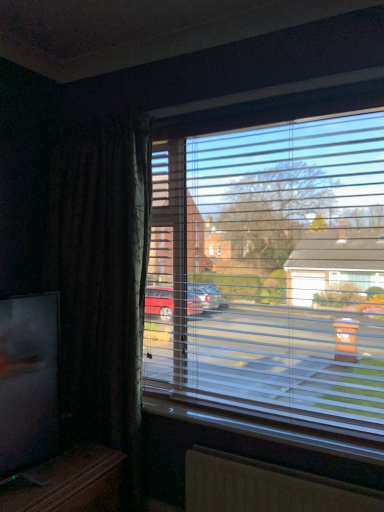
Find the location of a particular element. Image resolution: width=384 pixels, height=512 pixels. transparent plastic blinds at center is located at coordinates (282, 283).

Measure the distance between point (98, 469) and camera.

The distance of point (98, 469) from camera is 1.89 meters.

What is the approximate width of white plastic window sill at lower center?

The width of white plastic window sill at lower center is 6.18 inches.

Measure the distance between point (x=214, y=462) and camera.

Point (x=214, y=462) and camera are 6.45 feet apart.

The height and width of the screenshot is (512, 384). I want to click on transparent plastic blinds at center, so coord(282,283).

How different are the orientations of white plastic window sill at lower center and transparent plastic blinds at center in degrees?

→ The angular difference between white plastic window sill at lower center and transparent plastic blinds at center is 0.00219 degrees.

Considering the sizes of objects white plastic window sill at lower center and transparent plastic blinds at center in the image provided, who is smaller, white plastic window sill at lower center or transparent plastic blinds at center?

white plastic window sill at lower center is smaller.

Which of these two, white plastic window sill at lower center or transparent plastic blinds at center, stands shorter?

white plastic window sill at lower center.

Can you see white plastic window sill at lower center touching transparent plastic blinds at center?

They are not placed beside each other.

Does point (289, 492) appear closer or farther from the camera than point (224, 408)?

Point (289, 492) appears to be closer to the viewer than point (224, 408).

Does brown textured radiator at lower center turn towards white plastic window sill at lower center?

No, brown textured radiator at lower center is not oriented towards white plastic window sill at lower center.

I want to click on radiator to the right of white plastic window sill at lower center, so click(x=266, y=487).

Which object is wider, brown textured radiator at lower center or white plastic window sill at lower center?

white plastic window sill at lower center is wider.

From the picture: Is the position of matte black tv at lower left more distant than that of brown textured radiator at lower center?

No, it is in front of brown textured radiator at lower center.

Measure the distance between matte black tv at lower left and brown textured radiator at lower center.

The distance of matte black tv at lower left from brown textured radiator at lower center is 59.23 centimeters.

Is matte black tv at lower left inside the boundaries of brown textured radiator at lower center, or outside?

The correct answer is: outside.

From a real-world perspective, is matte black tv at lower left positioned over brown textured radiator at lower center based on gravity?

No, from a real-world perspective, matte black tv at lower left is not above brown textured radiator at lower center.

Between white plastic window sill at lower center and brown textured radiator at lower center, which one has smaller size?

Smaller between the two is white plastic window sill at lower center.

Is brown textured radiator at lower center at the back of white plastic window sill at lower center?

That's not correct — white plastic window sill at lower center is not looking away from brown textured radiator at lower center.

At what (x,y) coordinates should I click in order to perform the action: click on radiator on the right of the white plastic window sill at lower center. Please return your answer as a coordinate pair (x, y). Looking at the image, I should click on (266, 487).

From a real-world perspective, does white plastic window sill at lower center stand above brown textured radiator at lower center?

Indeed, from a real-world perspective, white plastic window sill at lower center stands above brown textured radiator at lower center.

Is brown textured radiator at lower center further to the viewer compared to transparent plastic blinds at center?

That is False.

From the image's perspective, which is below, brown textured radiator at lower center or transparent plastic blinds at center?

brown textured radiator at lower center, from the image's perspective.

Considering the relative positions of brown textured radiator at lower center and transparent plastic blinds at center in the image provided, is brown textured radiator at lower center to the left or to the right of transparent plastic blinds at center?

brown textured radiator at lower center is positioned on transparent plastic blinds at center's right side.

What's the angular difference between brown textured radiator at lower center and transparent plastic blinds at center's facing directions?

The angle between the facing direction of brown textured radiator at lower center and the facing direction of transparent plastic blinds at center is 0.0197 degrees.

What's the angular difference between white plastic window sill at lower center and matte black tv at lower left's facing directions?

white plastic window sill at lower center and matte black tv at lower left are facing 89.9 degrees away from each other.

Is white plastic window sill at lower center thinner than matte black tv at lower left?

Indeed, white plastic window sill at lower center has a lesser width compared to matte black tv at lower left.

Is there a large distance between white plastic window sill at lower center and matte black tv at lower left?

No, white plastic window sill at lower center is not far from matte black tv at lower left.

Are transparent plastic blinds at center and white plastic window sill at lower center beside each other?

No, transparent plastic blinds at center is not next to white plastic window sill at lower center.

Looking at this image, from their relative heights in the image, would you say transparent plastic blinds at center is taller or shorter than white plastic window sill at lower center?

In the image, transparent plastic blinds at center appears to be taller than white plastic window sill at lower center.

From a real-world perspective, who is located lower, transparent plastic blinds at center or white plastic window sill at lower center?

From a 3D spatial view, white plastic window sill at lower center is below.

Can you tell me how much transparent plastic blinds at center and white plastic window sill at lower center differ in facing direction?

0.00219 degrees separate the facing orientations of transparent plastic blinds at center and white plastic window sill at lower center.

Locate an element on the screen. The width and height of the screenshot is (384, 512). window sill on the left of transparent plastic blinds at center is located at coordinates click(266, 426).

The width and height of the screenshot is (384, 512). Identify the location of window sill lying above the brown textured radiator at lower center (from the image's perspective). (266, 426).

Consider the image. When comparing their distances from brown textured radiator at lower center, does transparent plastic blinds at center or white plastic window sill at lower center seem closer?

white plastic window sill at lower center lies closer to brown textured radiator at lower center than the other object.

From the image, which object appears to be farther from matte black tv at lower left, brown textured radiator at lower center or white plastic window sill at lower center?

Among the two, white plastic window sill at lower center is located further to matte black tv at lower left.

Looking at the image, which one is located further to transparent plastic blinds at center, brown textured radiator at lower center or white plastic window sill at lower center?

The object further to transparent plastic blinds at center is brown textured radiator at lower center.

From the image, which object appears to be farther from brown textured radiator at lower center, matte black tv at lower left or white plastic window sill at lower center?

Based on the image, matte black tv at lower left appears to be further to brown textured radiator at lower center.

Looking at the image, which one is located further to transparent plastic blinds at center, matte black tv at lower left or white plastic window sill at lower center?

Based on the image, matte black tv at lower left appears to be further to transparent plastic blinds at center.

Considering their positions, is matte black tv at lower left positioned closer to white plastic window sill at lower center than brown textured radiator at lower center?

brown textured radiator at lower center is closer to white plastic window sill at lower center.

When comparing their distances from transparent plastic blinds at center, does white plastic window sill at lower center or matte black tv at lower left seem closer?

Based on the image, white plastic window sill at lower center appears to be nearer to transparent plastic blinds at center.

When comparing their distances from matte black tv at lower left, does white plastic window sill at lower center or transparent plastic blinds at center seem closer?

The object closer to matte black tv at lower left is white plastic window sill at lower center.

What are the coordinates of `window sill between transparent plastic blinds at center and brown textured radiator at lower center from top to bottom` in the screenshot? It's located at (266, 426).

The width and height of the screenshot is (384, 512). Find the location of `window sill between matte black tv at lower left and brown textured radiator at lower center`. window sill between matte black tv at lower left and brown textured radiator at lower center is located at coordinates (266, 426).

Identify the location of window sill between transparent plastic blinds at center and matte black tv at lower left vertically. This screenshot has height=512, width=384. (266, 426).

Identify the location of radiator that lies between transparent plastic blinds at center and matte black tv at lower left from top to bottom. (266, 487).